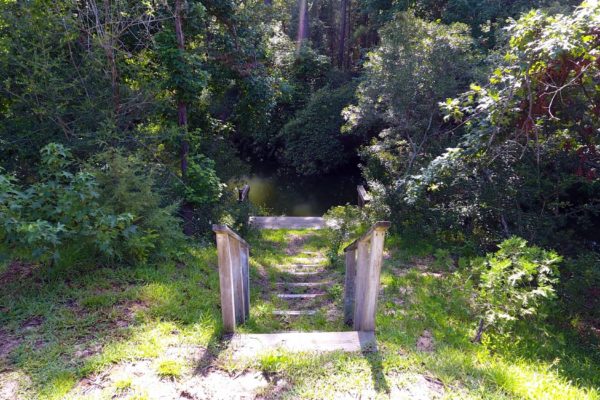
Identify the location of 1 left side of railing. (220, 269).